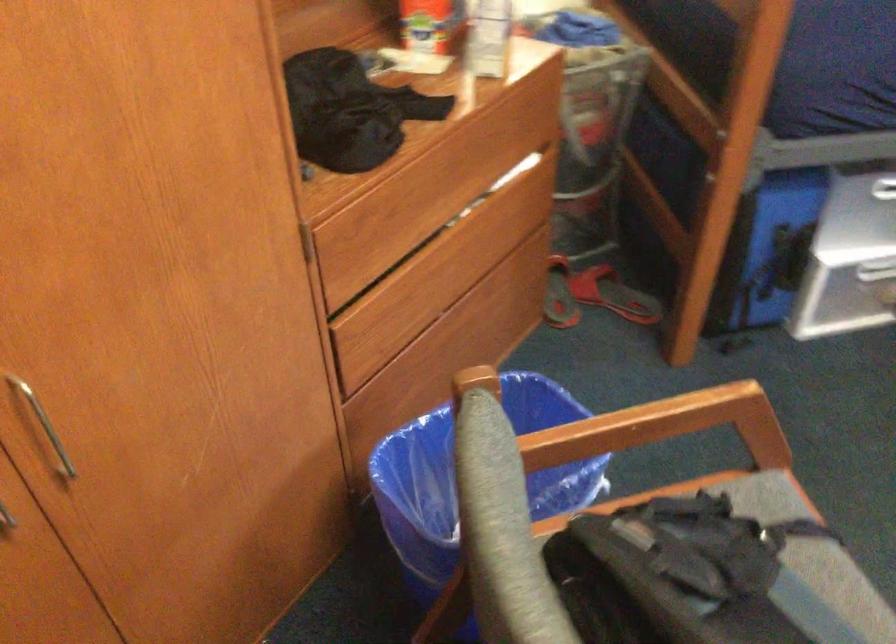
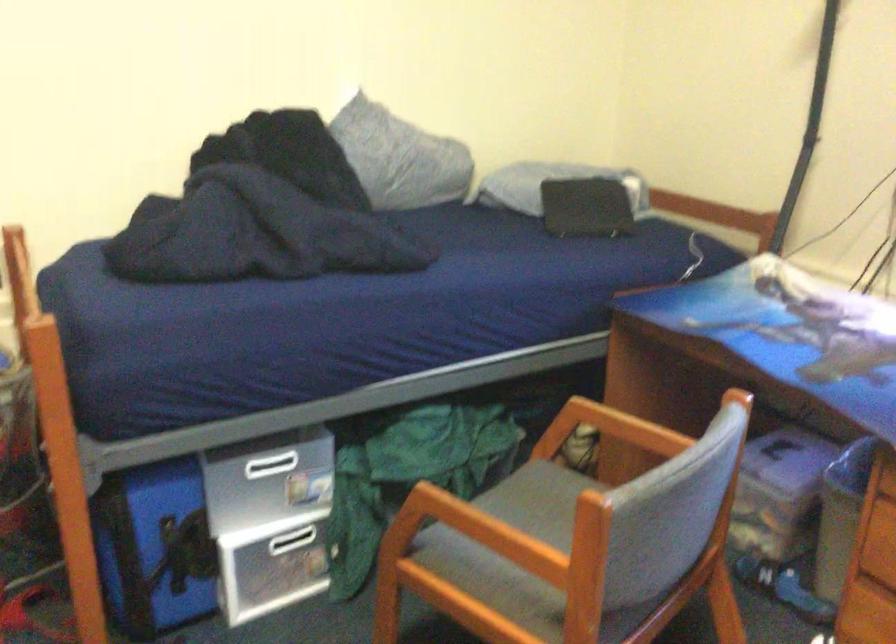
Question: What movement of the cameraman would produce the second image?

Choices:
 (A) Left
 (B) Right
 (C) Forward
 (D) Backward

Answer: (B)